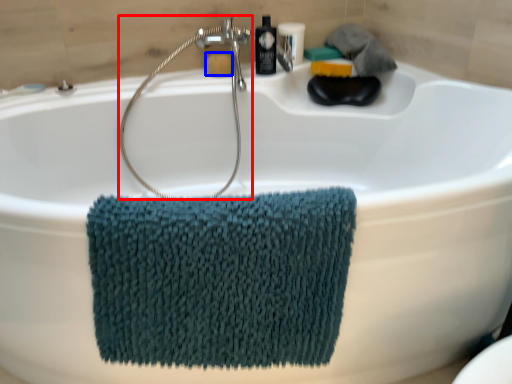
Question: Which of the following is the closest to the observer, shower (highlighted by a red box) or soap (highlighted by a blue box)?

Choices:
 (A) shower
 (B) soap

Answer: (A)